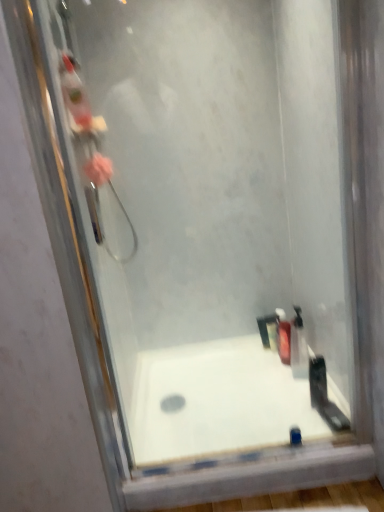
Question: Based on their positions, is translucent plastic bottle at lower right, which is the second toiletry from front to back, located to the left or right of white glossy bathtub at center?

Choices:
 (A) left
 (B) right

Answer: (B)

Question: Based on their sizes in the image, would you say translucent plastic bottle at lower right, which is the second toiletry from front to back, is bigger or smaller than white glossy bathtub at center?

Choices:
 (A) small
 (B) big

Answer: (A)

Question: Which of these objects is positioned closest to the pink fluffy sponge at left?

Choices:
 (A) translucent plastic soap dispenser at lower right, placed as the first toiletry when sorted from back to front
 (B) black plastic razor at right, which is the first toiletry in front-to-back order
 (C) white glossy bathtub at center
 (D) translucent plastic bottle at lower right, which is the second toiletry from front to back

Answer: (C)

Question: Which object is positioned farthest from the white glossy bathtub at center?

Choices:
 (A) pink fluffy sponge at left
 (B) translucent plastic soap dispenser at lower right, placed as the first toiletry when sorted from back to front
 (C) translucent plastic bottle at lower right, which appears as the second toiletry when viewed from the back
 (D) black plastic razor at right, the third toiletry when ordered from back to front

Answer: (A)